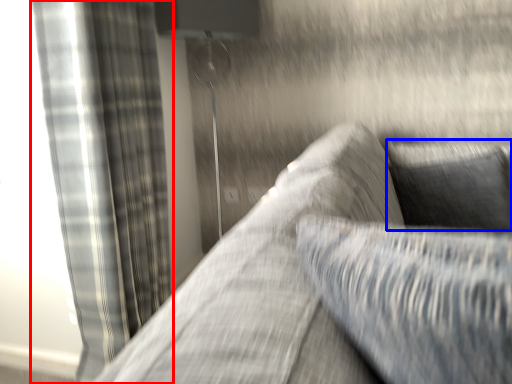
Question: Which object appears farthest to the camera in this image, curtain (highlighted by a red box) or pillow (highlighted by a blue box)?

Choices:
 (A) curtain
 (B) pillow

Answer: (B)